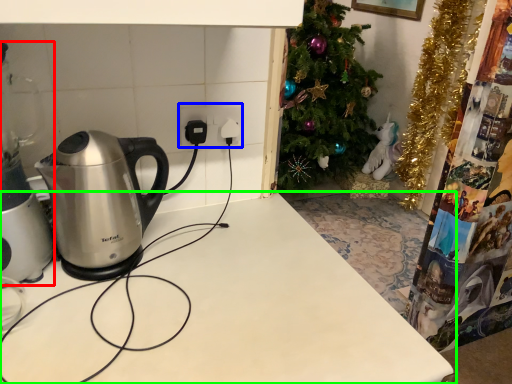
Question: Based on their relative distances, which object is farther from appliance (highlighted by a red box)? Choose from electric outlet (highlighted by a blue box) and table (highlighted by a green box).

Choices:
 (A) electric outlet
 (B) table

Answer: (A)